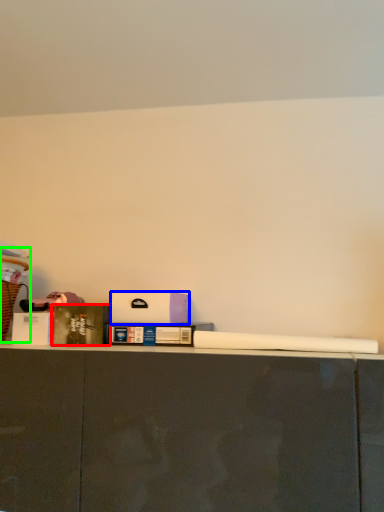
Question: Estimate the real-world distances between objects in this image. Which object is closer to book (highlighted by a red box), box (highlighted by a blue box) or laundry basket (highlighted by a green box)?

Choices:
 (A) box
 (B) laundry basket

Answer: (A)